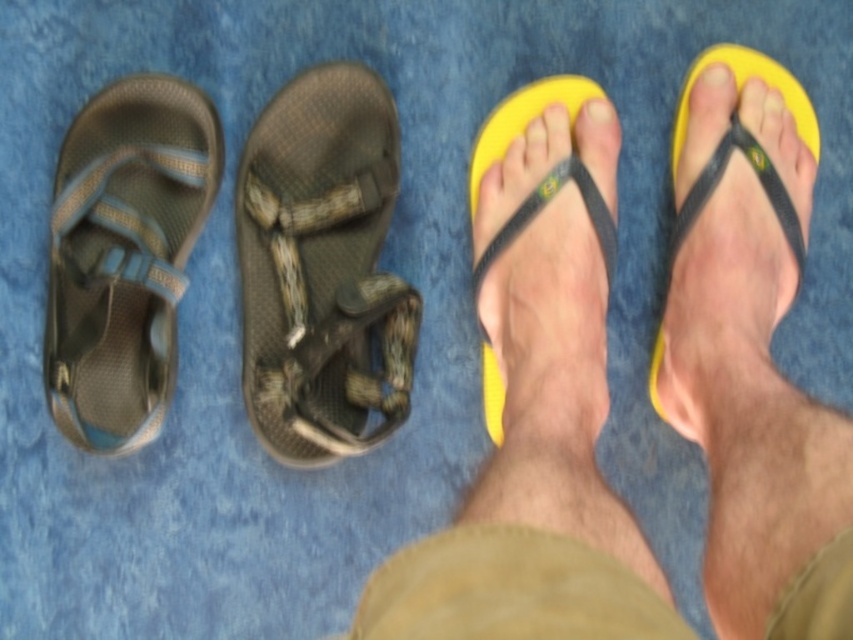
Question: Is textured brown sandal at center above yellow matte toe at upper center?

Choices:
 (A) no
 (B) yes

Answer: (A)

Question: Does yellow rubber flip-flops at center have a larger size compared to matte gray sandal at left?

Choices:
 (A) no
 (B) yes

Answer: (B)

Question: Which point appears farthest from the camera in this image?

Choices:
 (A) (753, 381)
 (B) (492, 134)
 (C) (670, 140)

Answer: (C)

Question: Can you confirm if matte gray sandal at left is bigger than yellow matte toe at upper center?

Choices:
 (A) no
 (B) yes

Answer: (B)

Question: Which object is closer to the camera taking this photo?

Choices:
 (A) yellow matte toe at upper center
 (B) yellow rubber flip-flop at right
 (C) textured brown sandal at center
 (D) matte gray sandal at left

Answer: (D)

Question: Which point appears closest to the camera in this image?

Choices:
 (A) (178, 156)
 (B) (775, 298)
 (C) (540, 86)

Answer: (A)